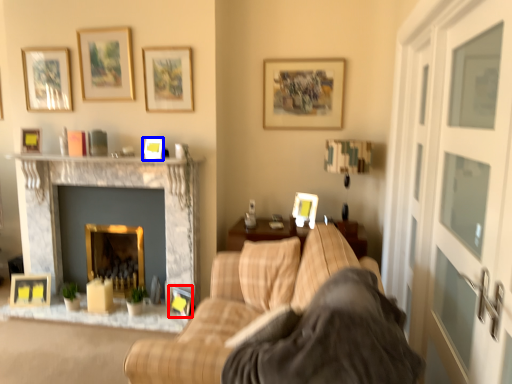
Question: Which of the following is the farthest to the observer, picture frame (highlighted by a red box) or picture frame (highlighted by a blue box)?

Choices:
 (A) picture frame
 (B) picture frame

Answer: (A)